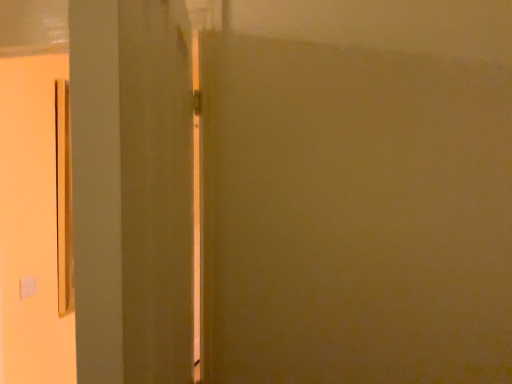
What do you see at coordinates (27, 286) in the screenshot? This screenshot has height=384, width=512. I see `white plastic light switch at lower left` at bounding box center [27, 286].

Find the location of `white plastic light switch at lower left`. white plastic light switch at lower left is located at coordinates (27, 286).

The image size is (512, 384). I want to click on white plastic light switch at lower left, so click(x=27, y=286).